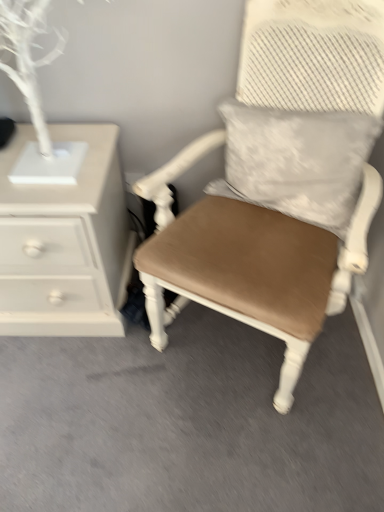
Identify the location of free point below matte brown cushioned chair at center (from a real-world perspective). (229, 342).